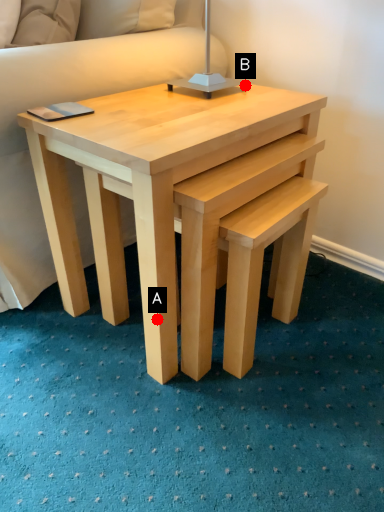
Question: Two points are circled on the image, labeled by A and B beside each circle. Which of the following is the closest to the observer?

Choices:
 (A) A is closer
 (B) B is closer

Answer: (A)